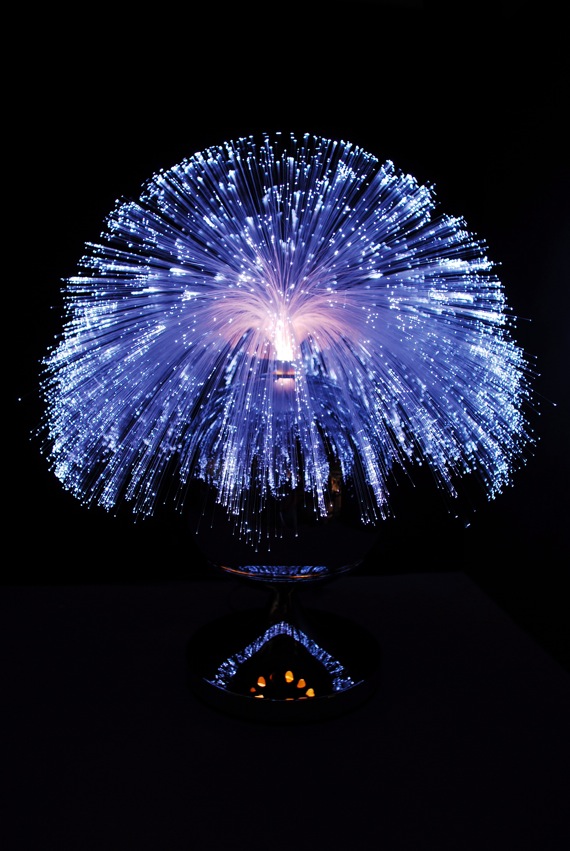
Find the location of a particular element. Image resolution: width=570 pixels, height=851 pixels. use to light up a room is located at coordinates (287, 340).